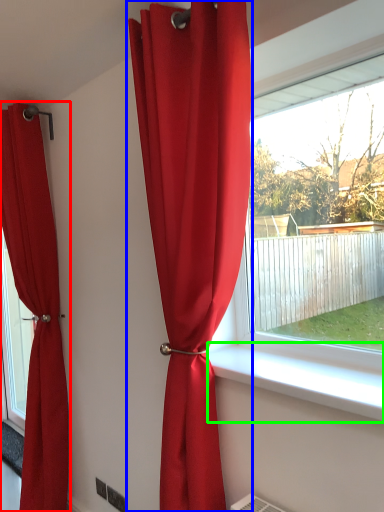
Question: Based on their relative distances, which object is nearer to curtain (highlighted by a red box)? Choose from curtain (highlighted by a blue box) and window sill (highlighted by a green box).

Choices:
 (A) curtain
 (B) window sill

Answer: (A)